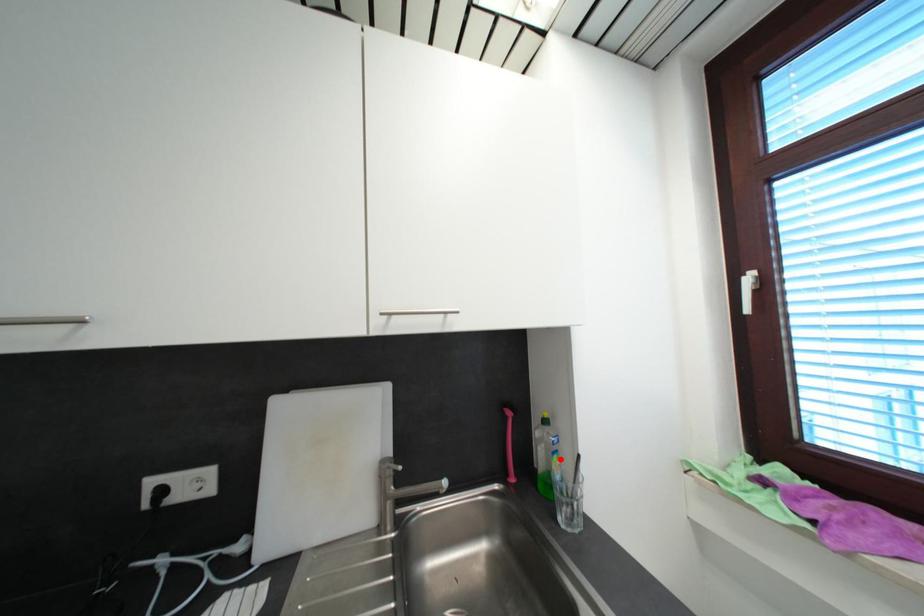
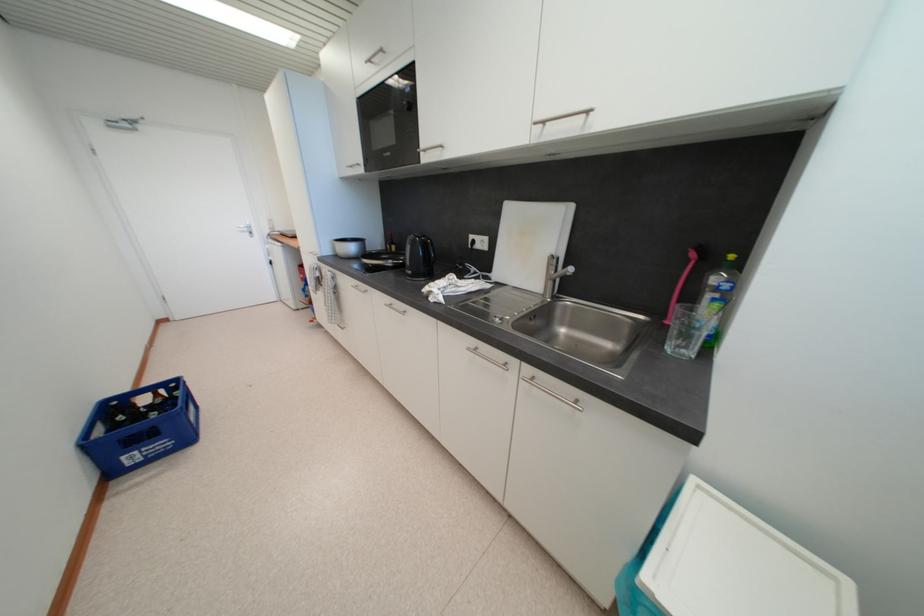
The point at the highlighted location is marked in the first image. Where is the corresponding point in the second image?

(723, 307)